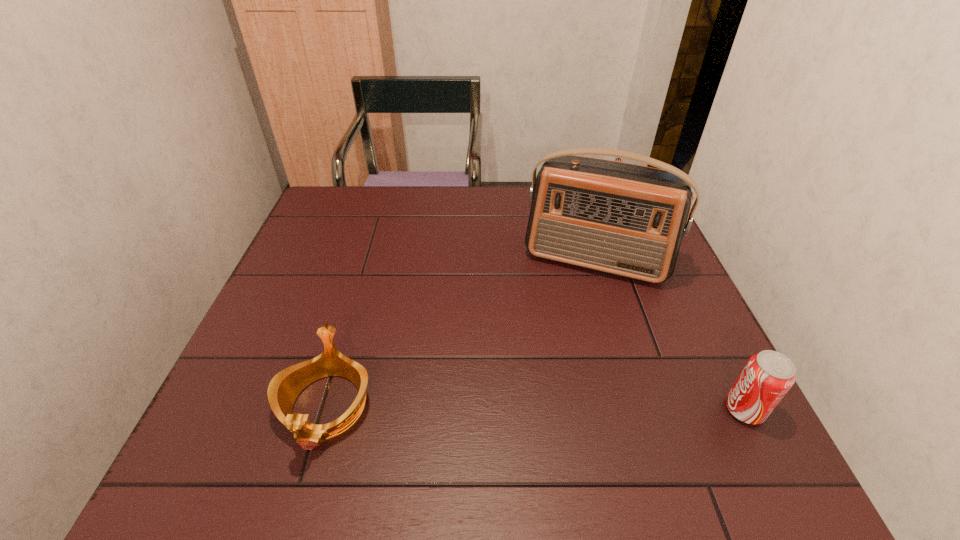
Find the location of `free point that satisfies the following two spatial constraints: 1. at the front emblem of the soda can; 2. on the logo side of the leftmost object`. free point that satisfies the following two spatial constraints: 1. at the front emblem of the soda can; 2. on the logo side of the leftmost object is located at coordinates (325, 409).

At what (x,y) coordinates should I click in order to perform the action: click on vacant region that satisfies the following two spatial constraints: 1. on the front side of the radio receiver; 2. on the logo side of the soda can. Please return your answer as a coordinate pair (x, y). This screenshot has height=540, width=960. Looking at the image, I should click on (641, 409).

Where is `free spot that satisfies the following two spatial constraints: 1. at the front emblem of the soda can; 2. on the logo side of the leftmost object`? free spot that satisfies the following two spatial constraints: 1. at the front emblem of the soda can; 2. on the logo side of the leftmost object is located at coordinates (325, 409).

This screenshot has width=960, height=540. Find the location of `free space that satisfies the following two spatial constraints: 1. on the back side of the radio receiver; 2. on the left side of the puncher`. free space that satisfies the following two spatial constraints: 1. on the back side of the radio receiver; 2. on the left side of the puncher is located at coordinates pyautogui.click(x=577, y=197).

Where is `free space that satisfies the following two spatial constraints: 1. at the front emblem of the leftmost object; 2. on the logo side of the soda can`? The height and width of the screenshot is (540, 960). free space that satisfies the following two spatial constraints: 1. at the front emblem of the leftmost object; 2. on the logo side of the soda can is located at coordinates (325, 409).

The width and height of the screenshot is (960, 540). I want to click on vacant space that satisfies the following two spatial constraints: 1. at the front emblem of the leftmost object; 2. on the logo side of the soda can, so click(325, 409).